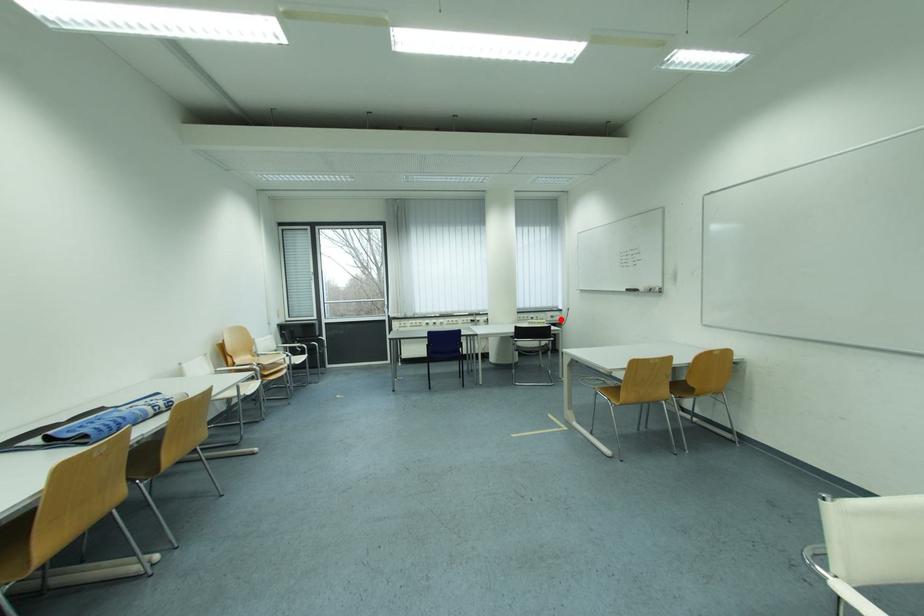
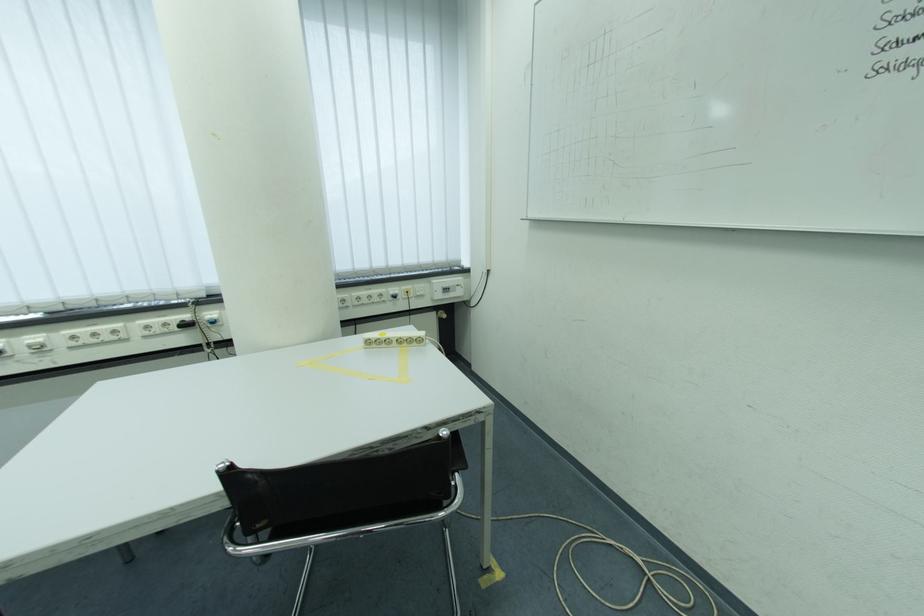
Find the pixel in the second image that matches the highlighted location in the first image.

(455, 292)